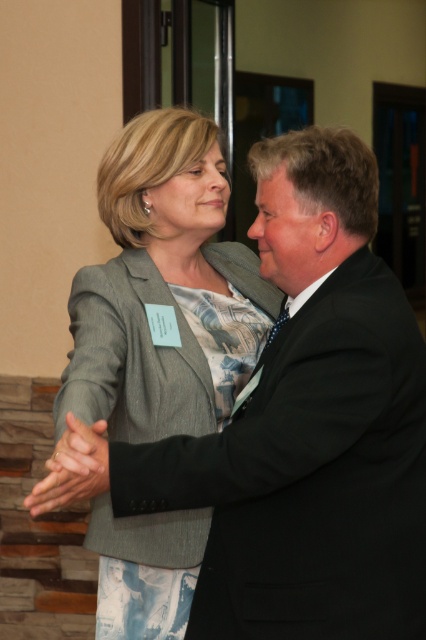
You are standing in front of the two people shaking hands. You notice two points marked on the image. The first point is at coordinates point (124,502) and the second point is at point (193,296). Which of these points is closer to you?

Point (124,502) is closer to the viewer than point (193,296).

You are a photographer at a formal event. You need to capture a photo of the black satin business suit at center and the gray textured blazer at center. Which one is positioned lower in the frame?

The black satin business suit at center is located below the gray textured blazer at center, so it is positioned lower in the frame.